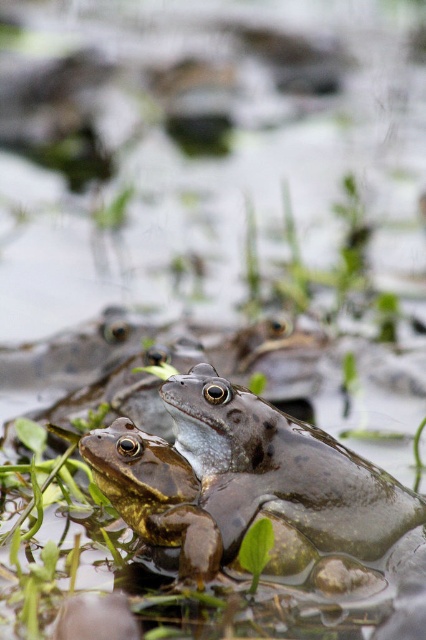
Question: Does smooth green frog at center appear under green matte frog at center?

Choices:
 (A) no
 (B) yes

Answer: (A)

Question: Which point is closer to the camera?

Choices:
 (A) [x=178, y=468]
 (B) [x=348, y=515]

Answer: (B)

Question: Is smooth green frog at center bigger than green matte frog at center?

Choices:
 (A) yes
 (B) no

Answer: (A)

Question: Is smooth green frog at center below green matte frog at center?

Choices:
 (A) no
 (B) yes

Answer: (A)

Question: Which of the following is the closest to the observer?

Choices:
 (A) (238, 449)
 (B) (138, 480)

Answer: (B)